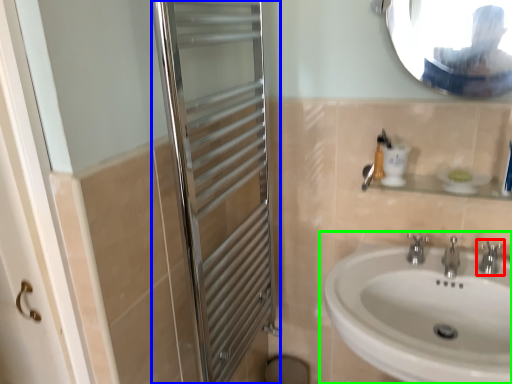
Question: Considering the real-world distances, which object is closest to tap (highlighted by a red box)? screen door (highlighted by a blue box) or sink (highlighted by a green box).

Choices:
 (A) screen door
 (B) sink

Answer: (B)